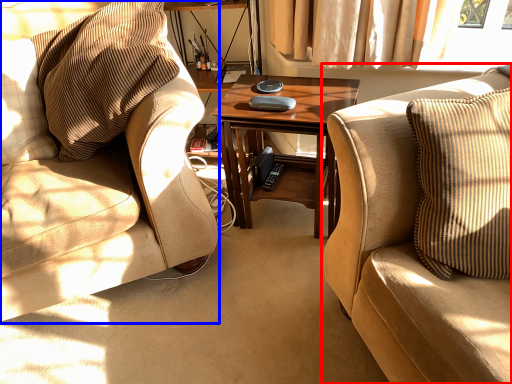
Question: Which object appears closest to the camera in this image, studio couch (highlighted by a red box) or chair (highlighted by a blue box)?

Choices:
 (A) studio couch
 (B) chair

Answer: (A)